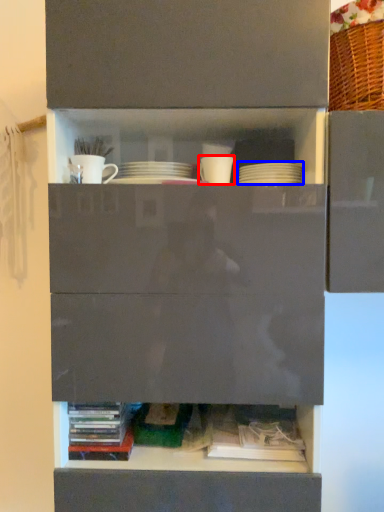
Question: Which of the following is the closest to the observer, tableware (highlighted by a red box) or tableware (highlighted by a blue box)?

Choices:
 (A) tableware
 (B) tableware

Answer: (B)